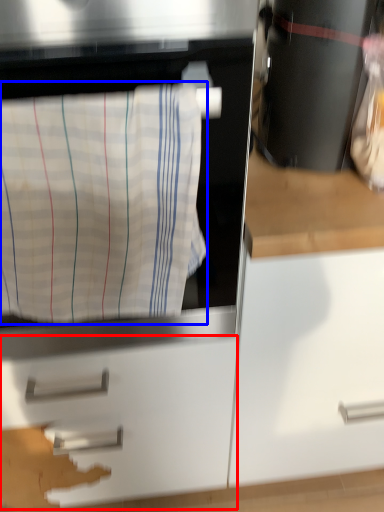
Question: Among these objects, which one is nearest to the camera, drawer (highlighted by a red box) or laundry (highlighted by a blue box)?

Choices:
 (A) drawer
 (B) laundry

Answer: (B)